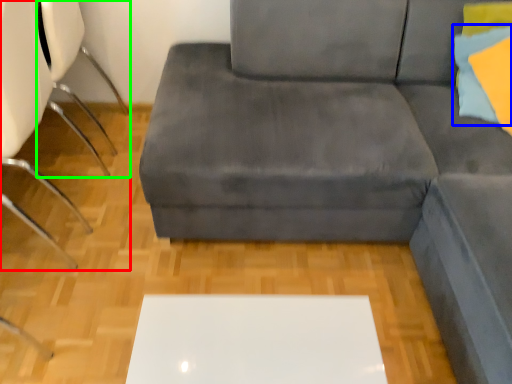
Question: Considering the real-world distances, which object is closest to chair (highlighted by a red box)? pillow (highlighted by a blue box) or swivel chair (highlighted by a green box).

Choices:
 (A) pillow
 (B) swivel chair

Answer: (B)